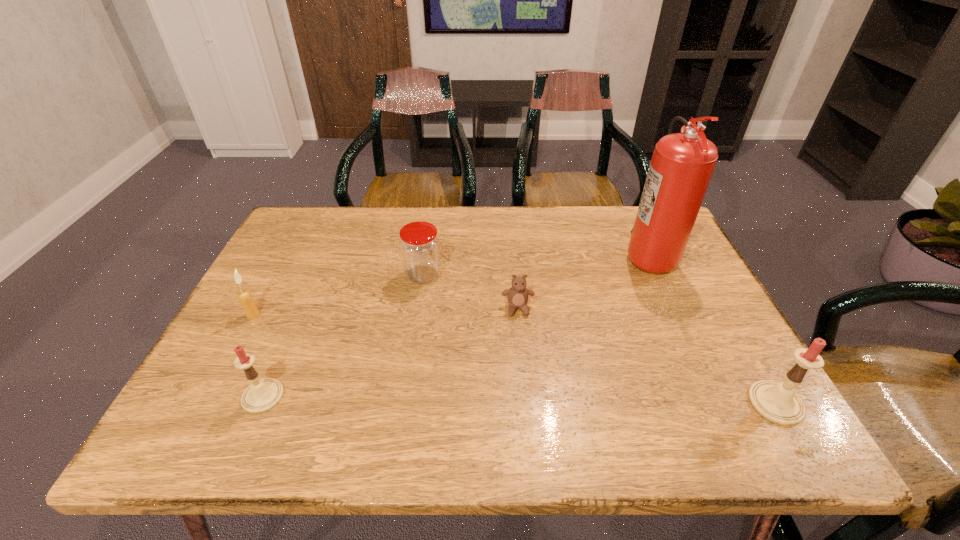
If the aim is uniform spacing by inserting an additional candle among them, please point to a vacant space for this new candle. Please provide its 2D coordinates. Your answer should be formatted as a tuple, i.e. [(x, y)], where the tuple contains the x and y coordinates of a point satisfying the conditions above.

[(517, 400)]